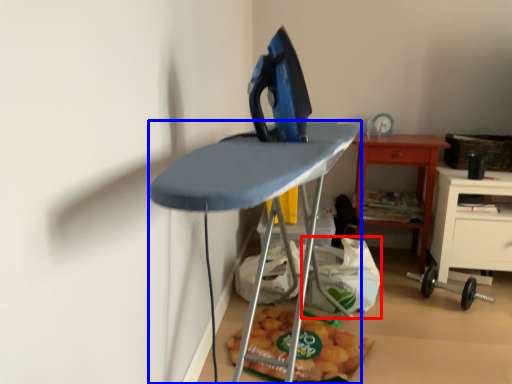
Question: Among these objects, which one is nearest to the camera, grocery bag (highlighted by a red box) or furniture (highlighted by a blue box)?

Choices:
 (A) grocery bag
 (B) furniture

Answer: (B)